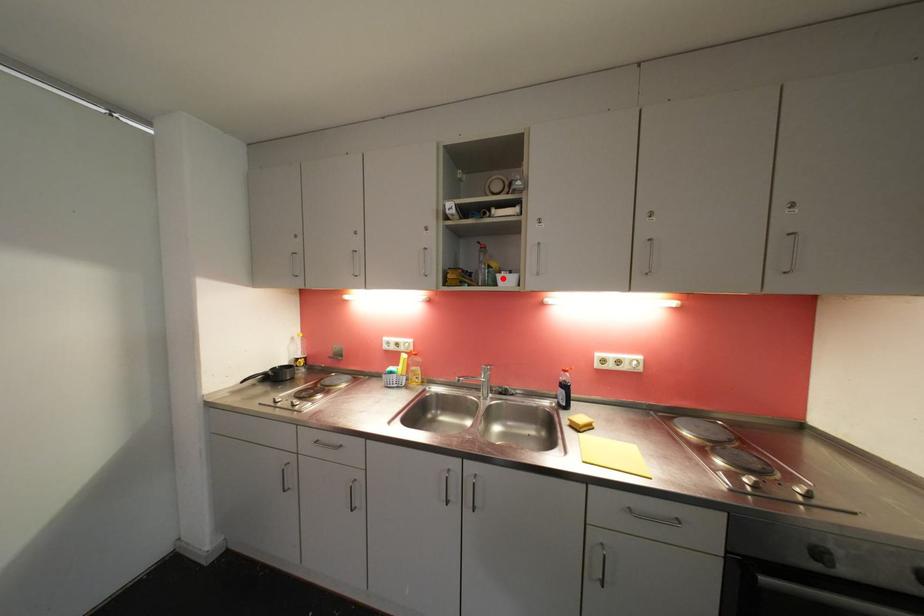
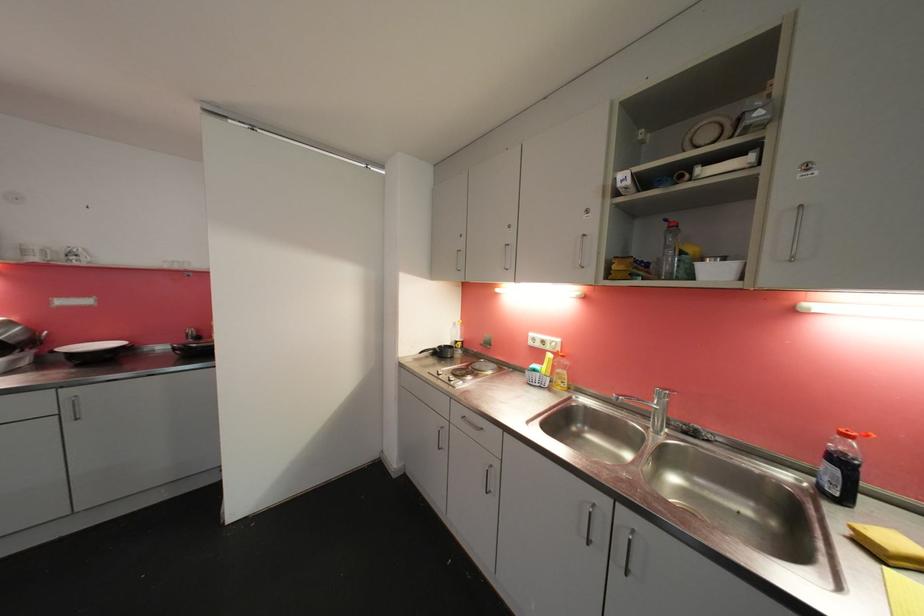
Find the pixel in the second image that matches the highlighted location in the first image.

(703, 267)